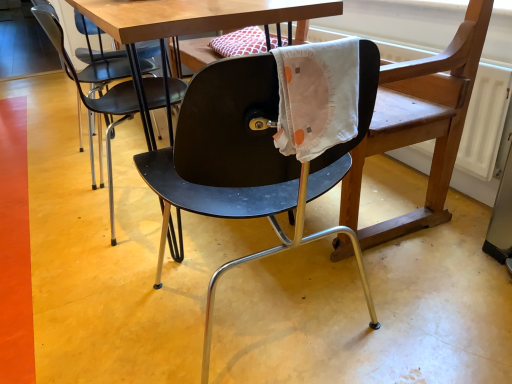
Locate an element on the screen. The height and width of the screenshot is (384, 512). free space in front of matte black swivel chair at center is located at coordinates (330, 266).